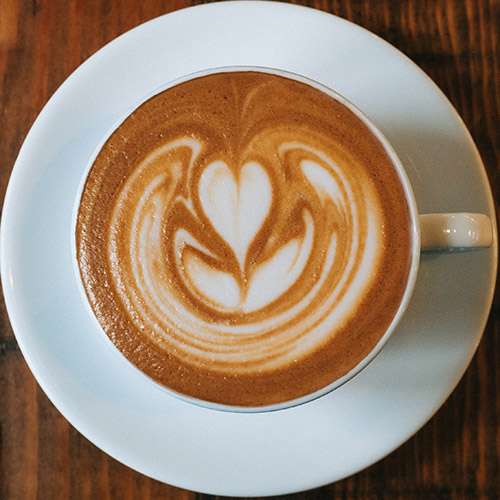
Find the location of a particular element. The width and height of the screenshot is (500, 500). left side of cup is located at coordinates (77, 246).